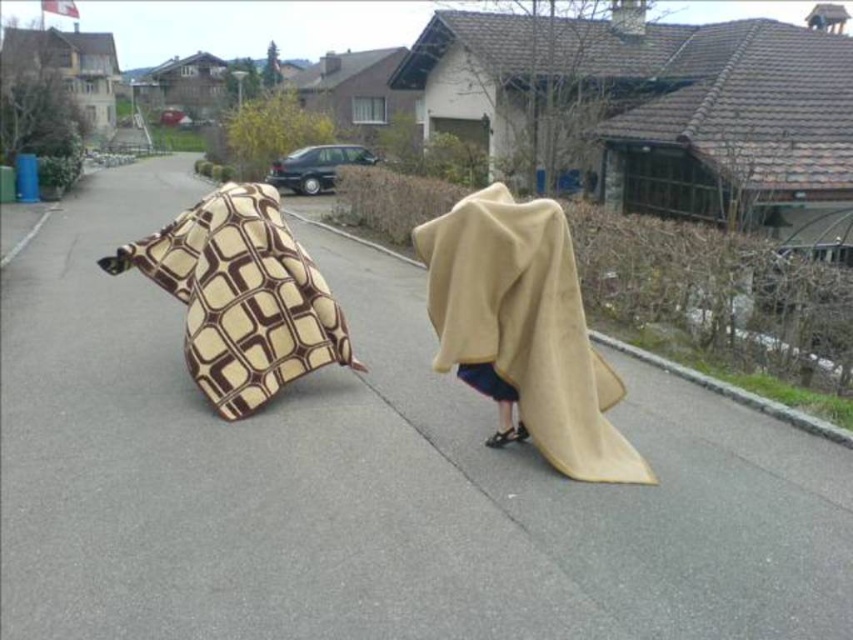
Consider the image. Who is more distant from viewer, (494,182) or (252,214)?

The point (494,182) is behind.

Can you confirm if beige fleece blanket at center is positioned to the left of brown and beige patterned blanket at left?

In fact, beige fleece blanket at center is to the right of brown and beige patterned blanket at left.

Does point (599, 467) come behind point (230, 234)?

No, (599, 467) is closer to viewer.

Where is `beige fleece blanket at center`? Image resolution: width=853 pixels, height=640 pixels. beige fleece blanket at center is located at coordinates (524, 330).